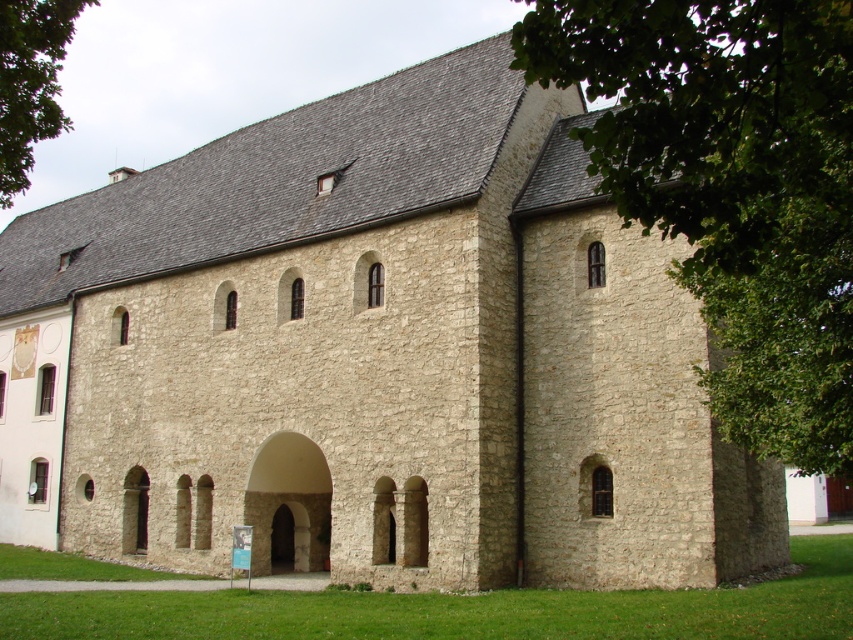
You are standing in front of the historic stone building. You notice a green leafy tree at upper right and a stone archway at center. Which object is positioned more to the right side of the building?

The green leafy tree at upper right is positioned more to the right side of the building than the stone archway at center.

You are standing in front of the historic stone building and want to take a photo of both the green leafy tree at upper right and the stone archway at center. Which object should you focus on first to ensure both are in clear view?

You should focus on the green leafy tree at upper right first because it is closer to the viewer than the stone archway at center, so adjusting focus from near to far will help capture both clearly.